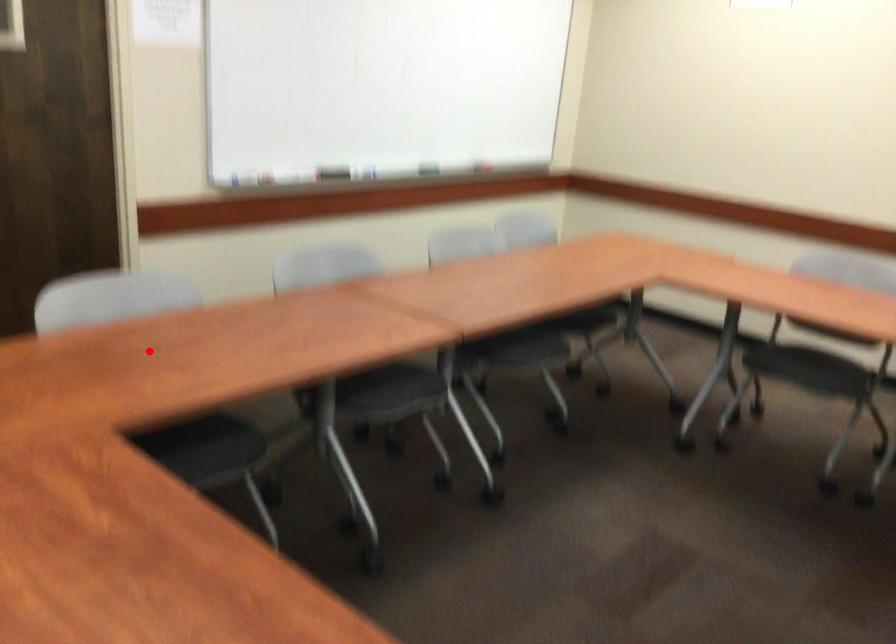
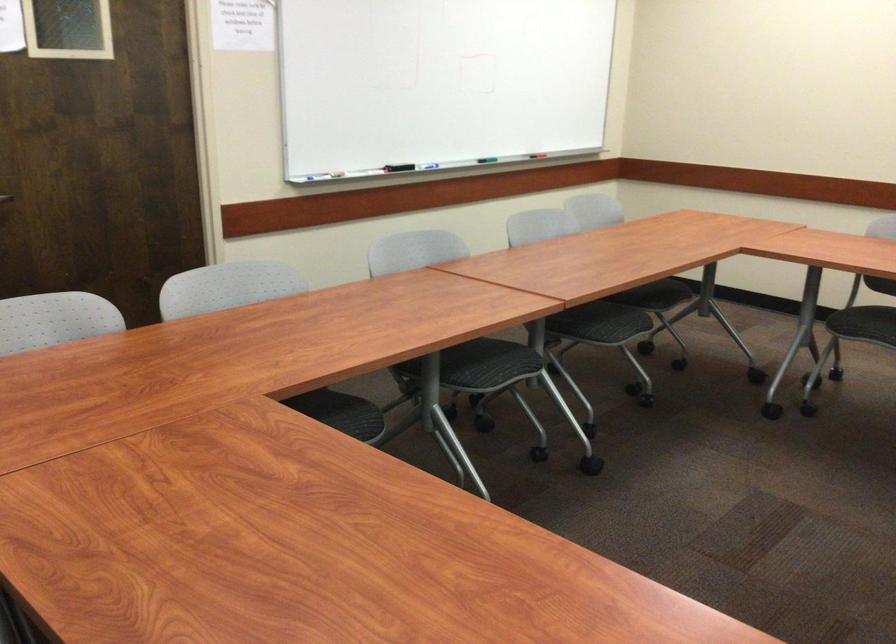
In the second image, find the point that corresponds to the highlighted location in the first image.

(265, 330)